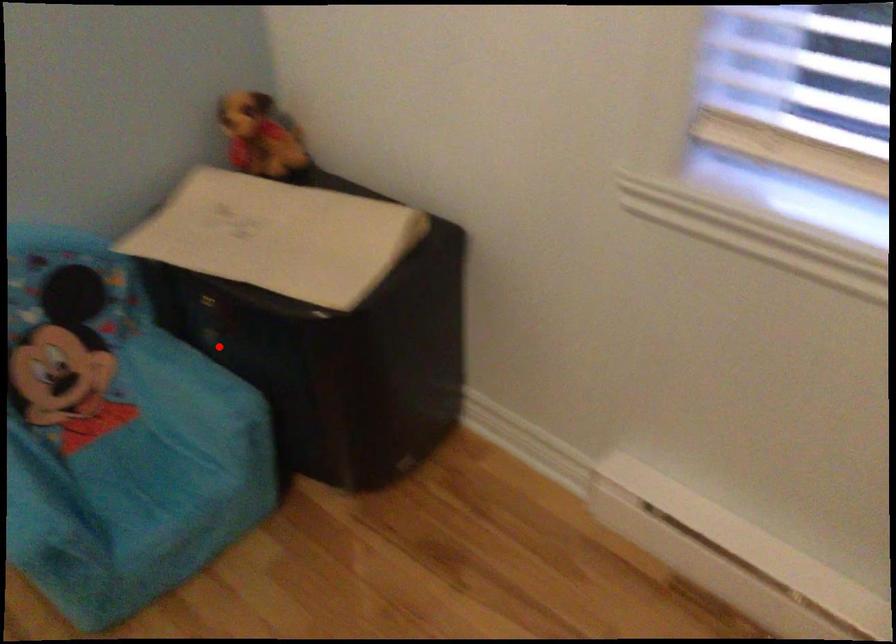
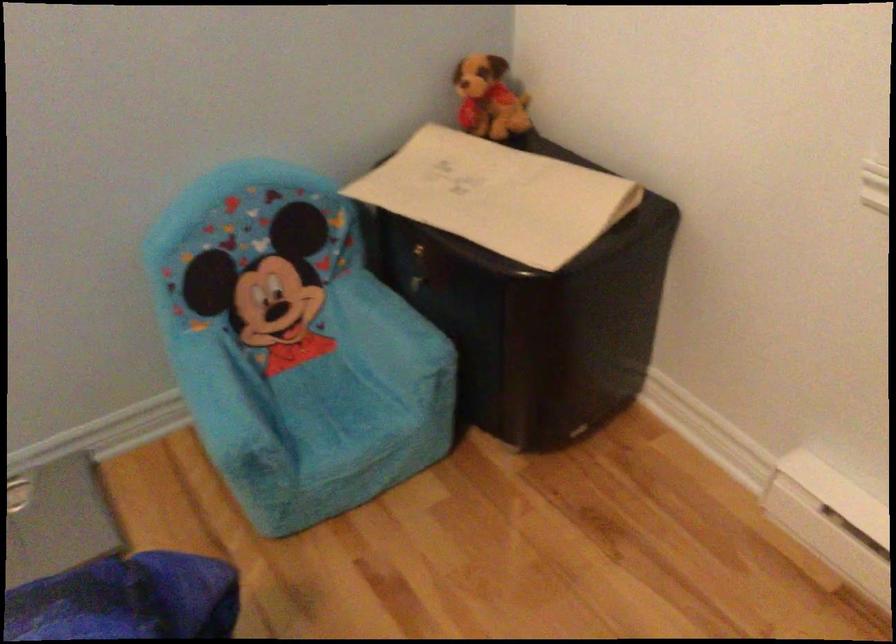
The point at the highlighted location is marked in the first image. Where is the corresponding point in the second image?

(419, 292)